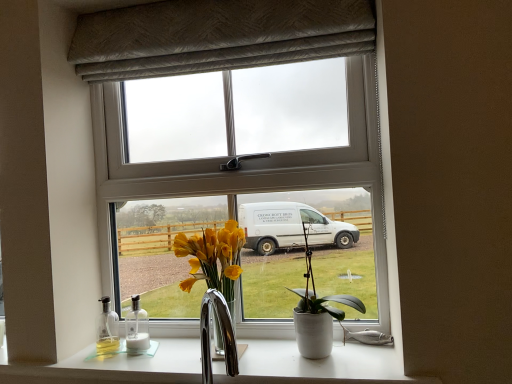
Find the location of a particular element. The image size is (512, 384). free space to the left of white ceramic pot at center is located at coordinates (257, 357).